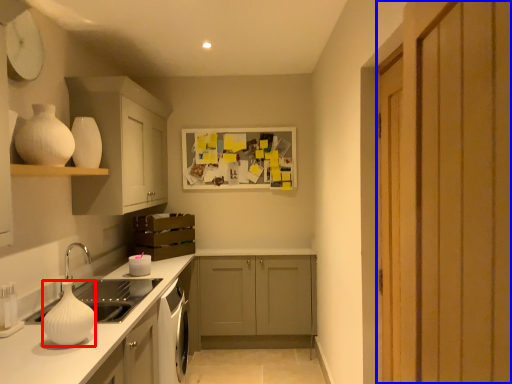
Question: Which object is further to the camera taking this photo, vase (highlighted by a red box) or door (highlighted by a blue box)?

Choices:
 (A) vase
 (B) door

Answer: (A)